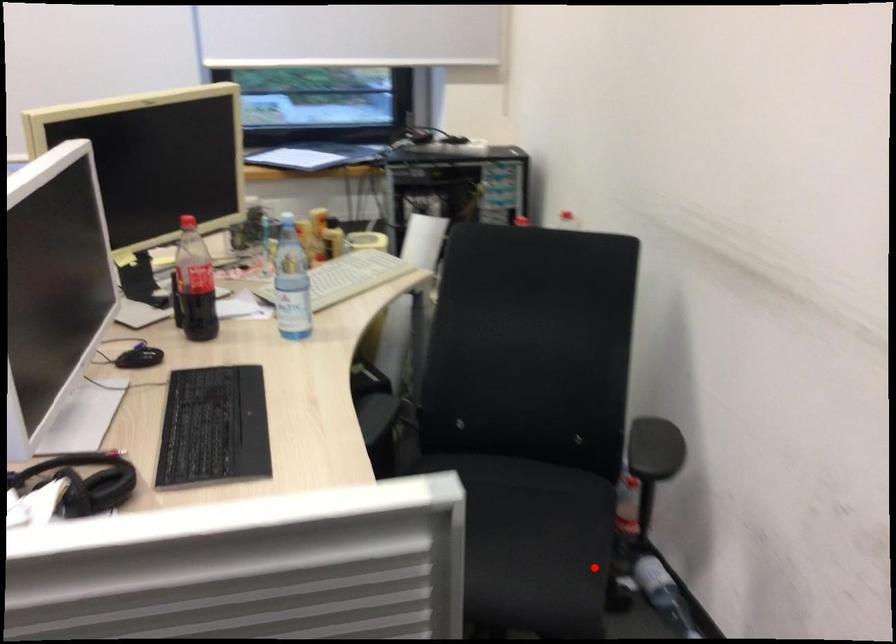
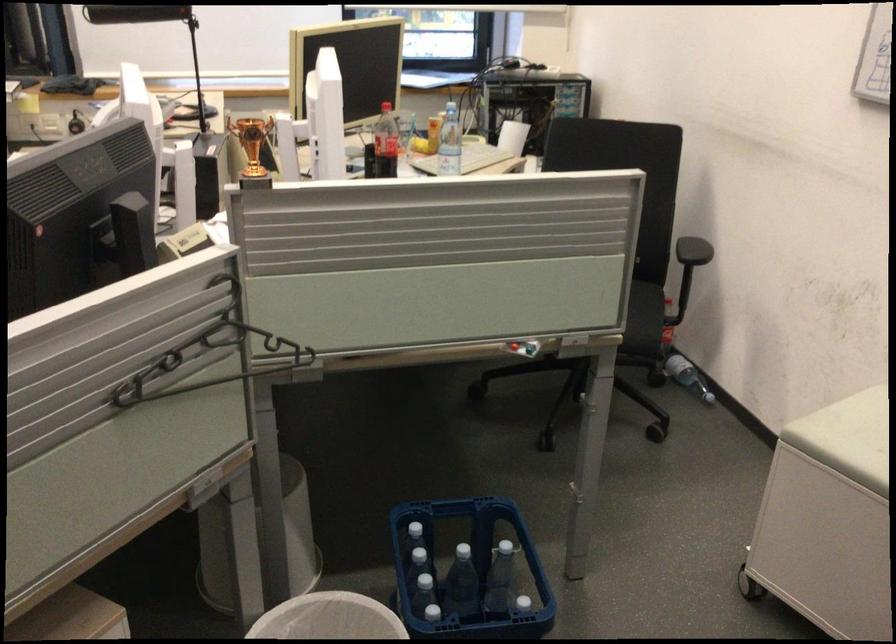
Where in the second image is the point corresponding to the highlighted location from the first image?

(648, 319)